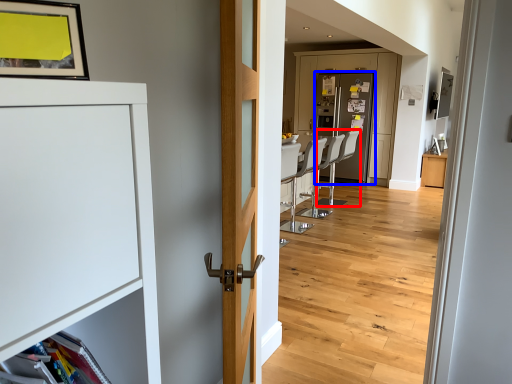
Question: Among these objects, which one is farthest to the camera, armchair (highlighted by a red box) or screen door (highlighted by a blue box)?

Choices:
 (A) armchair
 (B) screen door

Answer: (B)